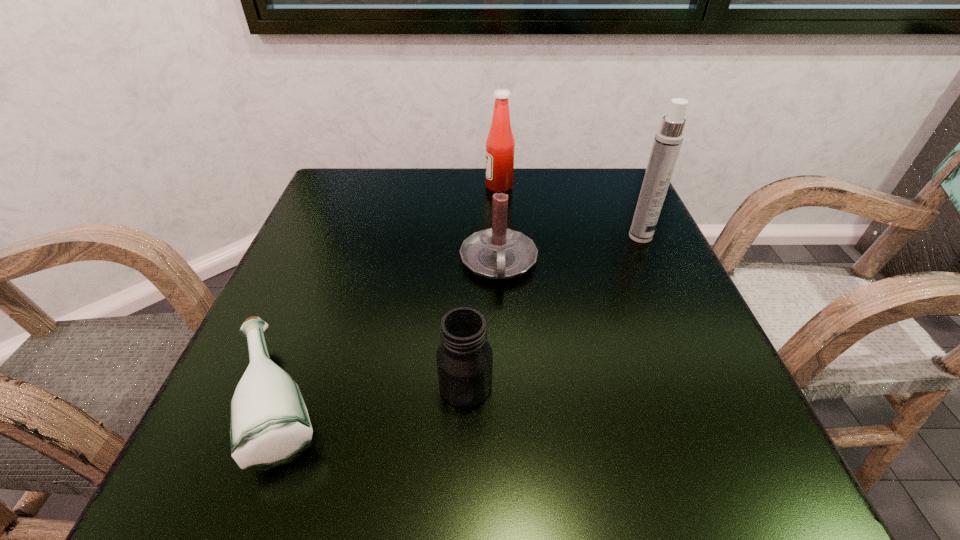
Image resolution: width=960 pixels, height=540 pixels. I want to click on the rightmost object, so click(668, 139).

At what (x,y) coordinates should I click in order to perform the action: click on aerosol can. Please return your answer as a coordinate pair (x, y). This screenshot has height=540, width=960. Looking at the image, I should click on (668, 139).

The image size is (960, 540). Identify the location of the fourth shortest object. (500, 145).

Identify the location of condiment. This screenshot has height=540, width=960. (500, 145).

Identify the location of candle. Image resolution: width=960 pixels, height=540 pixels. (496, 253).

The image size is (960, 540). Identify the location of jar. (464, 357).

Identify the location of the leftmost object. (269, 423).

Identify the location of bottle. This screenshot has height=540, width=960. (269, 423).

The height and width of the screenshot is (540, 960). I want to click on vacant space located 0.100m on the front of the rightmost object, so click(x=658, y=275).

Image resolution: width=960 pixels, height=540 pixels. Identify the location of vacant point located 0.380m on the front-facing side of the farthest object. (332, 186).